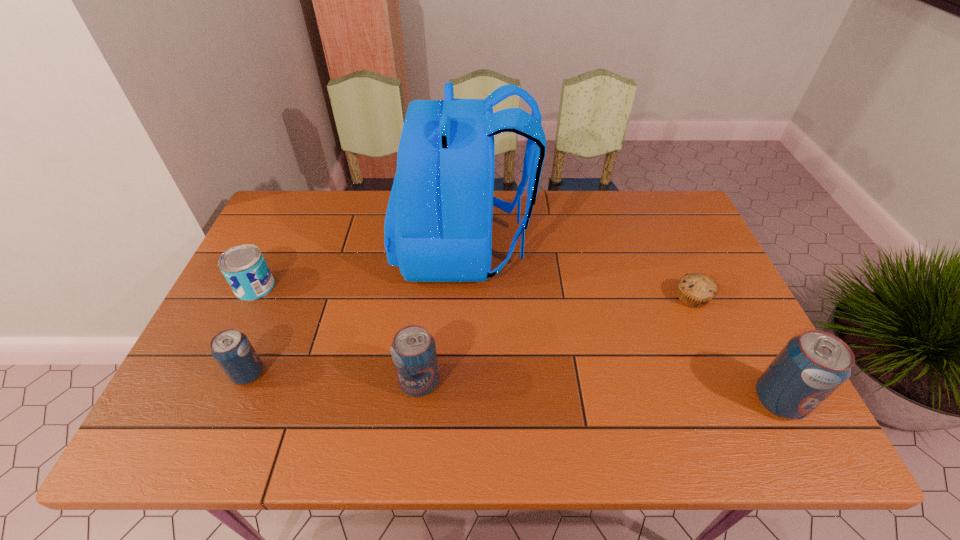
Locate an element on the screen. The width and height of the screenshot is (960, 540). free space between the tallest object and the can is located at coordinates (359, 267).

Image resolution: width=960 pixels, height=540 pixels. I want to click on free space between the rightmost pop soda and the leftmost pop soda, so click(x=514, y=387).

The image size is (960, 540). I want to click on unoccupied area between the tallest pop soda and the tallest object, so tap(621, 323).

The image size is (960, 540). In order to click on vacant space that's between the shortest pop soda and the second pop soda from left to right in this screenshot , I will do `click(334, 378)`.

At what (x,y) coordinates should I click in order to perform the action: click on free spot between the tallest pop soda and the shortest object. Please return your answer as a coordinate pair (x, y). This screenshot has height=540, width=960. Looking at the image, I should click on (735, 349).

This screenshot has width=960, height=540. Identify the location of empty space between the tallest object and the second shortest pop soda. (442, 315).

You are a GUI agent. You are given a task and a screenshot of the screen. Output one action in this format:
    pyautogui.click(x=<x>, y=<y>)
    Task: Click on the free space that is in between the backpack and the leftmost pop soda
    This screenshot has height=540, width=960.
    Given the screenshot: What is the action you would take?
    pyautogui.click(x=356, y=310)

Identify the location of object that is the fifth closest to the shortest object. (244, 267).

At what (x,y) coordinates should I click in order to perform the action: click on object that is the third closest to the shortest object. Please return your answer as a coordinate pair (x, y). Looking at the image, I should click on (413, 350).

The height and width of the screenshot is (540, 960). In order to click on pop soda that is the second closest to the can in this screenshot , I will do `click(413, 350)`.